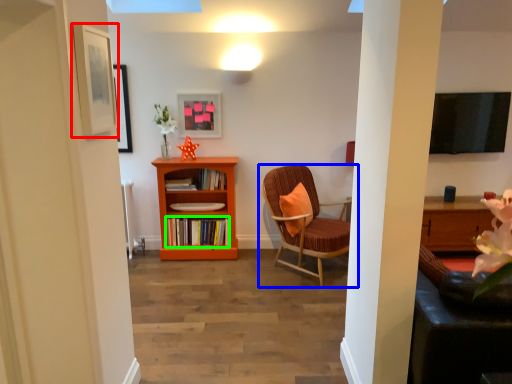
Question: Which object is the closest to the picture frame (highlighted by a red box)? Choose among these: chair (highlighted by a blue box) or book (highlighted by a green box).

Choices:
 (A) chair
 (B) book

Answer: (A)